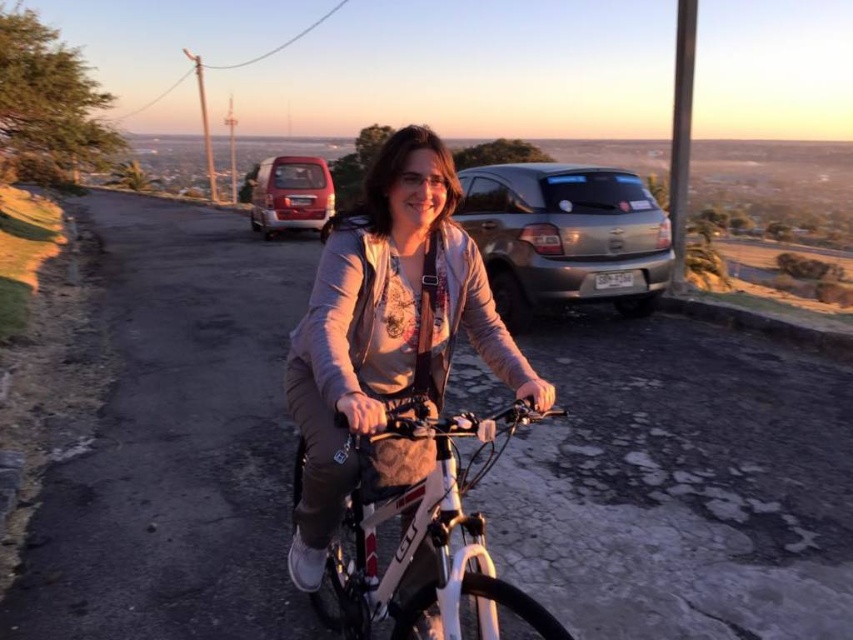
Can you confirm if matte gray jacket at center is smaller than white matte bicycle at center?

No.

Is point (339, 444) behind point (442, 522)?

That is True.

Where is `matte gray jacket at center`? matte gray jacket at center is located at coordinates (386, 337).

Does satin silver suv at upper center have a lesser height compared to metallic red van at upper left?

Indeed, satin silver suv at upper center has a lesser height compared to metallic red van at upper left.

Between satin silver suv at upper center and metallic red van at upper left, which one is positioned higher?

metallic red van at upper left is higher up.

Identify the location of satin silver suv at upper center. The height and width of the screenshot is (640, 853). pos(566,236).

At what (x,y) coordinates should I click in order to perform the action: click on satin silver suv at upper center. Please return your answer as a coordinate pair (x, y). Image resolution: width=853 pixels, height=640 pixels. Looking at the image, I should click on (566, 236).

Is white matte bicycle at center to the right of metallic red van at upper left from the viewer's perspective?

Indeed, white matte bicycle at center is positioned on the right side of metallic red van at upper left.

Based on the photo, is white matte bicycle at center shorter than metallic red van at upper left?

Yes, white matte bicycle at center is shorter than metallic red van at upper left.

Which is behind, point (370, 529) or point (315, 227)?

Point (315, 227)

Locate an element on the screen. The image size is (853, 640). white matte bicycle at center is located at coordinates (430, 536).